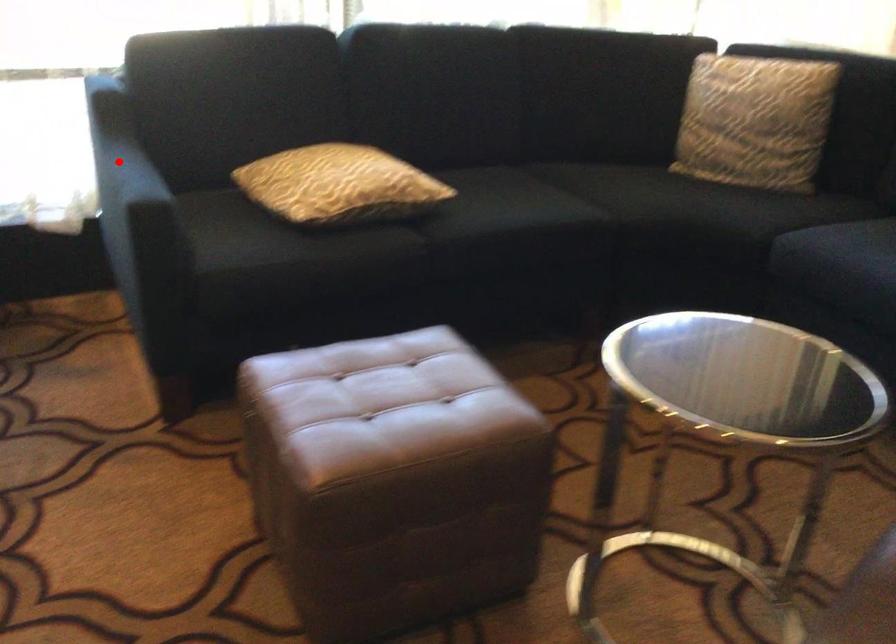
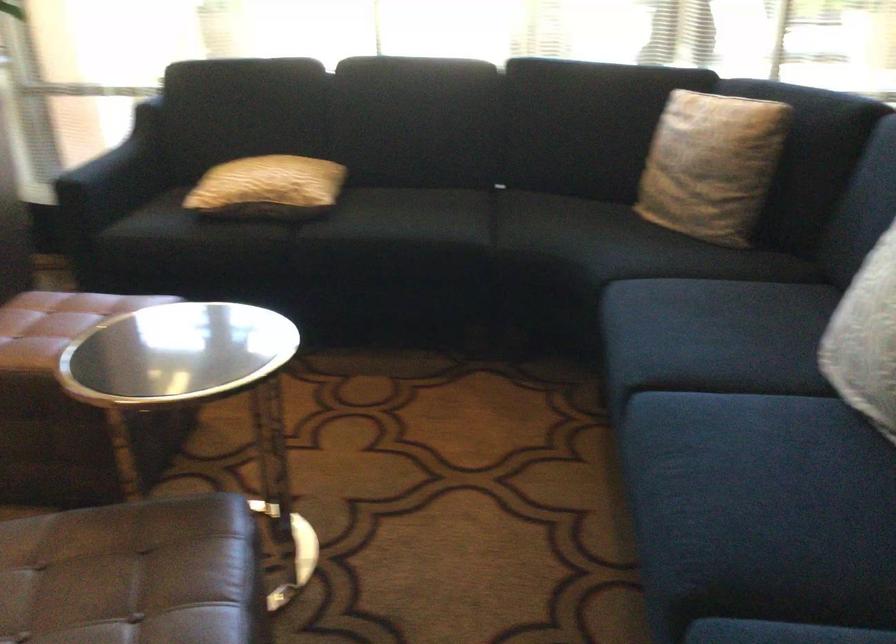
Locate, in the second image, the point that corresponds to the highlighted location in the first image.

(104, 147)